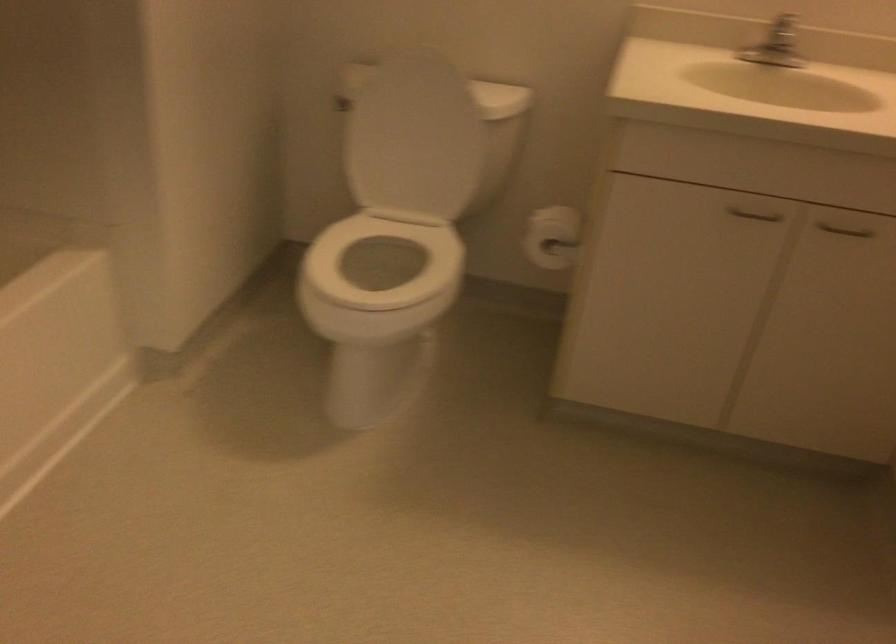
What do you see at coordinates (340, 104) in the screenshot?
I see `the toilet flush handle` at bounding box center [340, 104].